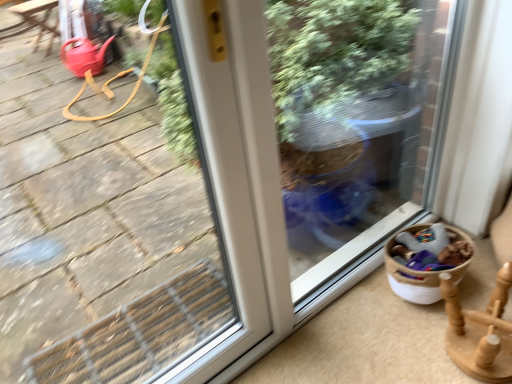
Measure the distance between wooden spinning top at lower right and camera.

The depth of wooden spinning top at lower right is 39.18 inches.

The height and width of the screenshot is (384, 512). Describe the element at coordinates (480, 331) in the screenshot. I see `wooden spinning top at lower right` at that location.

Locate an element on the screen. wooden spinning top at lower right is located at coordinates (480, 331).

What is the approximate height of wooden spinning top at lower right?

It is 9.05 inches.

The width and height of the screenshot is (512, 384). In order to click on wooden spinning top at lower right in this screenshot , I will do `click(480, 331)`.